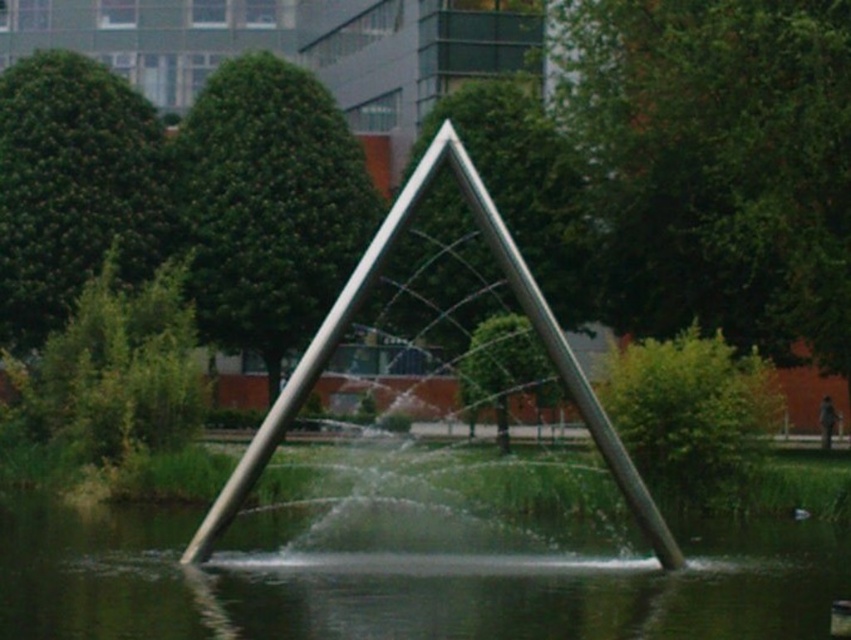
Which is below, clear water at center or polished metal fountain at center?

clear water at center is lower down.

How far apart are clear water at center and polished metal fountain at center?

A distance of 3.08 meters exists between clear water at center and polished metal fountain at center.

Describe the element at coordinates (403, 577) in the screenshot. This screenshot has height=640, width=851. I see `clear water at center` at that location.

Image resolution: width=851 pixels, height=640 pixels. I want to click on clear water at center, so click(x=403, y=577).